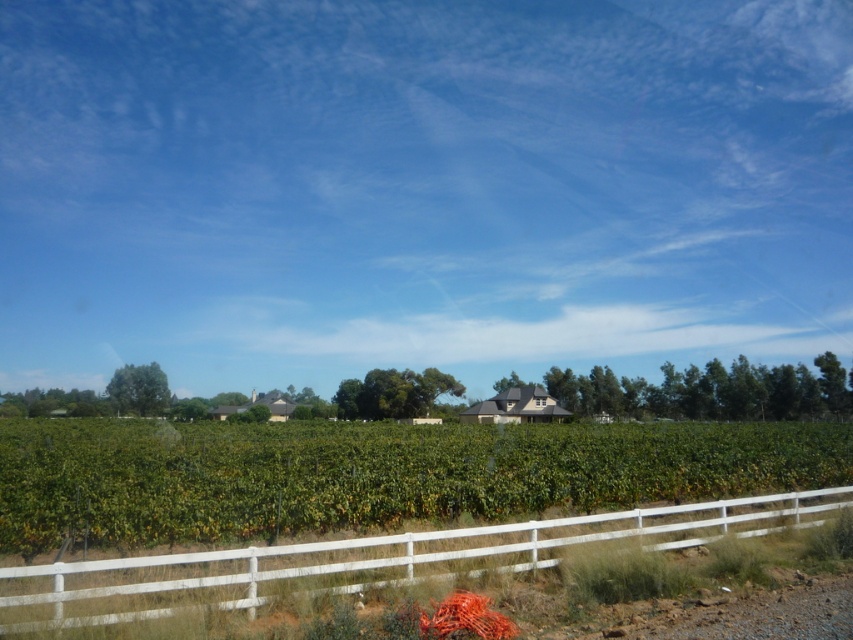
You are standing at the center of the image and want to walk towards the white wooden fence along the lower part. Which direction should you head to reach the green leafy vineyard at center first before reaching the fence?

The green leafy vineyard at center is located at point (373, 474), which is closer to the viewer than the white wooden fence along the lower part. Therefore, you should head forward towards the green leafy vineyard at center first before reaching the fence.

You are standing in the rural landscape and want to walk from the green leafy vineyard at center to the white wooden fence at lower center. Which direction should you move to get closer to the fence?

To move closer to the white wooden fence at lower center from the green leafy vineyard at center, you should move forward since the vineyard is closer to you than the fence.

You are a gardener standing at the edge of the vineyard. You need to access the white wooden fence at lower center to repair it. However, there are green leafy vines in the way. Based on the scene, can you reach the fence without stepping on the green leafy vineyard at center?

The green leafy vineyard at center is positioned under the white wooden fence at lower center, meaning the fence is above the vineyard. Since the fence is at lower center and the vineyard is beneath it, you can reach the fence without stepping on the vineyard by approaching from the area above the vineyard where the fence is located.